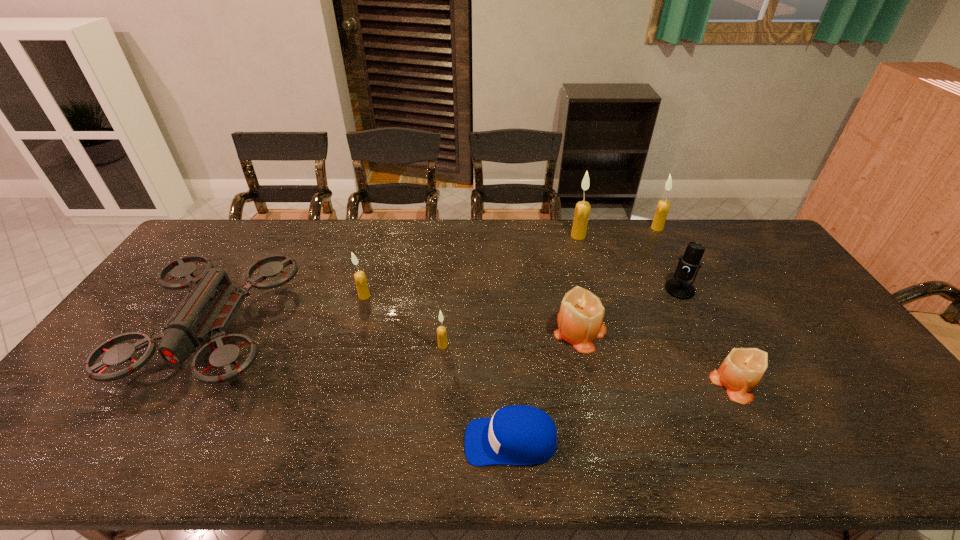
Find the location of a particular element. free space at the far edge of the desktop is located at coordinates (334, 224).

Where is `vacant space at the near edge of the desktop`? The height and width of the screenshot is (540, 960). vacant space at the near edge of the desktop is located at coordinates (355, 460).

In the image, there is a desktop. Where is `vacant region at the left edge`? Image resolution: width=960 pixels, height=540 pixels. vacant region at the left edge is located at coordinates (138, 307).

This screenshot has height=540, width=960. In order to click on vacant region at the near left corner in this screenshot , I will do (41, 450).

Identify the location of vacant space at the far right corner. The width and height of the screenshot is (960, 540). (750, 227).

Find the location of a particular element. empty space that is in between the fourth nearest candle and the microphone is located at coordinates (522, 293).

Identify the location of vacant region between the bigger beige candle and the smallest cream candle. This screenshot has width=960, height=540. (512, 338).

Where is `vacant space in between the microphone and the leftmost object`? The image size is (960, 540). vacant space in between the microphone and the leftmost object is located at coordinates (447, 309).

This screenshot has width=960, height=540. Identify the location of blank region between the farthest candle and the eighth object from right to left. (511, 262).

Locate an element on the screen. free spot between the smallest cream candle and the eighth nearest object is located at coordinates (511, 291).